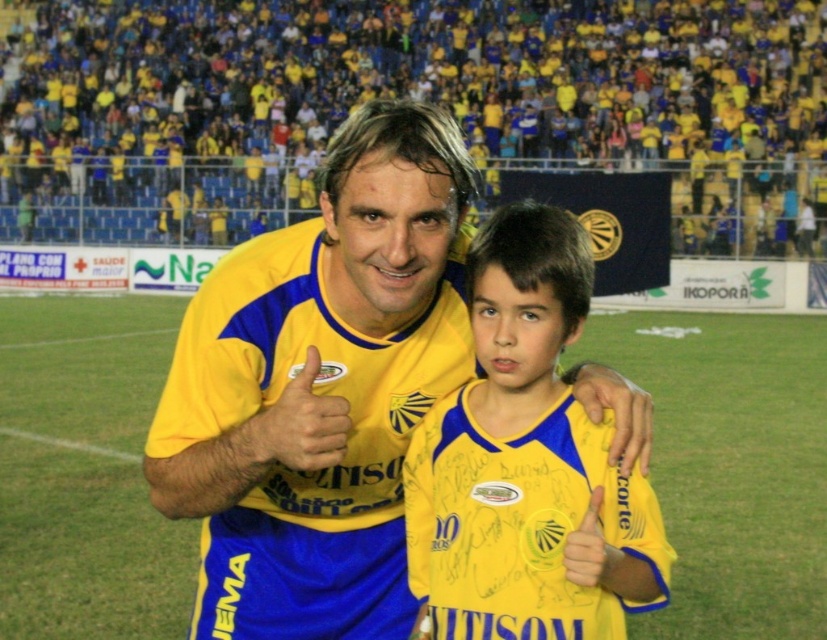
You are a photographer at the soccer stadium and want to capture a photo of both the yellow matte jersey at center and the yellow jersey at center. Which one is on the left side?

The yellow matte jersey at center is positioned on the left side of the yellow jersey at center.

You are a photographer standing at the point with coordinates (422, 77) in the soccer stadium image. What object is directly beneath your feet?

The yellow matte jersey at center is located at point (422, 77), so the object directly beneath your feet is the yellow matte jersey at center.

You are a photographer standing at the edge of the soccer field. You want to take a photo of both the yellow matte jersey at center and the yellow jersey at center. Given that your camera can focus on objects within a 20 meter range, will you be able to capture both players in the same frame without moving?

The yellow matte jersey at center and yellow jersey at center are 21.62 meters apart, which exceeds the camera focus range of 20 meters. Therefore, you cannot capture both players in the same frame without moving.